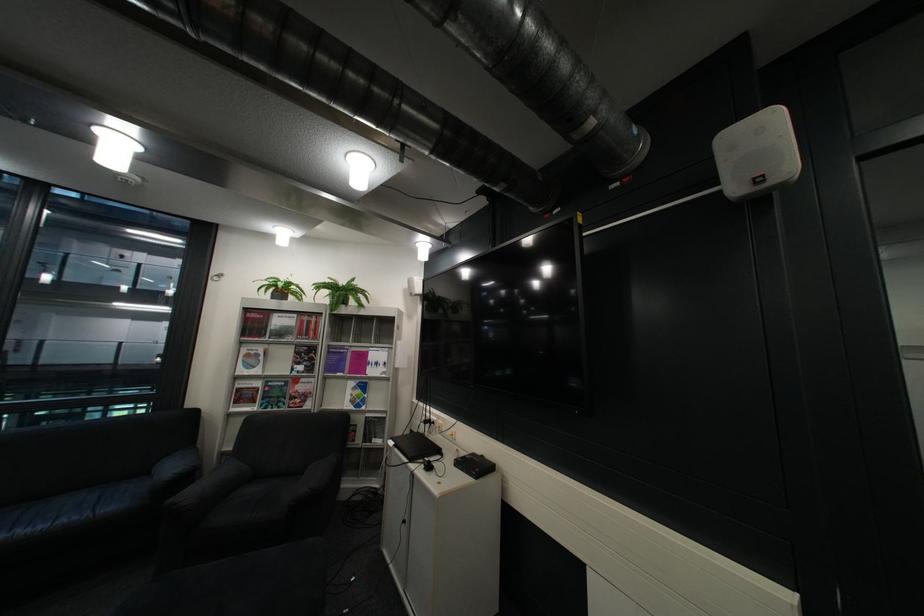
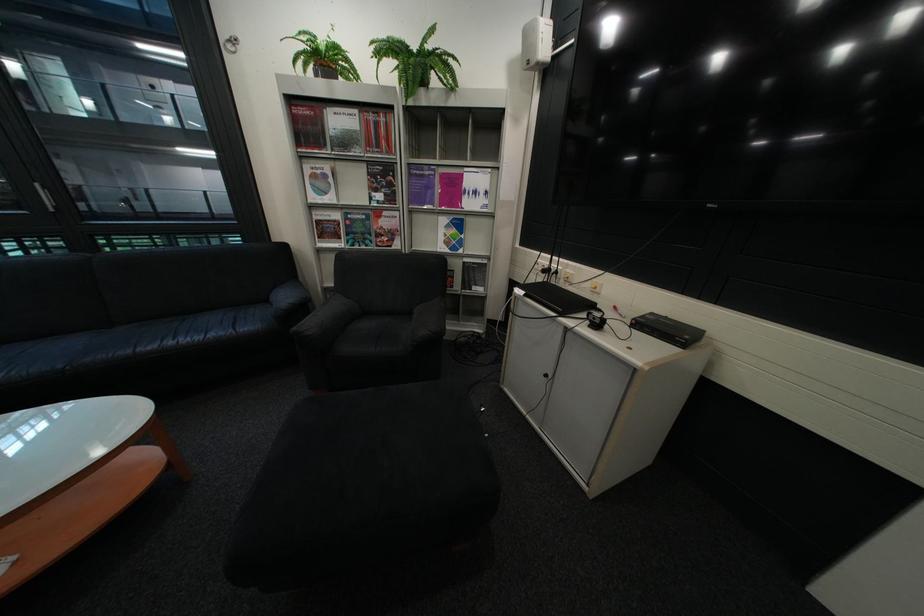
Locate, in the second image, the point that corresponds to the point at 407,445 in the first image.

(538, 293)